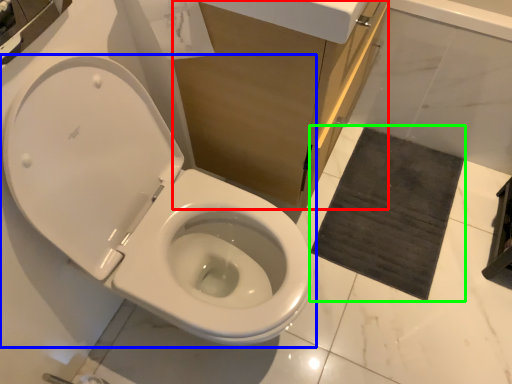
Question: Considering the real-world distances, which object is farthest from cabinetry (highlighted by a red box)? toilet (highlighted by a blue box) or bath mat (highlighted by a green box)?

Choices:
 (A) toilet
 (B) bath mat

Answer: (B)